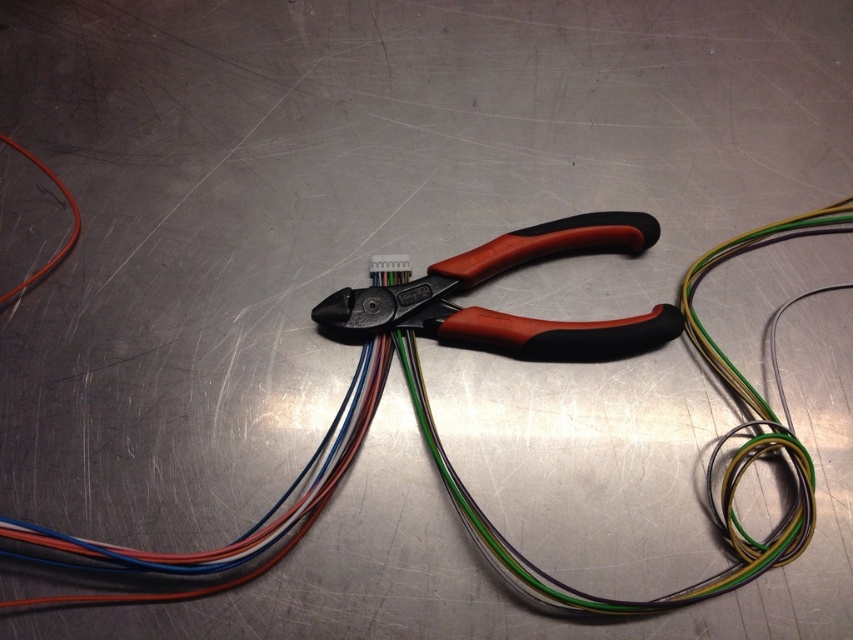
Question: Which point is closer to the camera?

Choices:
 (A) matte black pliers at center
 (B) orange rubberized pliers at center

Answer: (B)

Question: Which object is farther from the camera taking this photo?

Choices:
 (A) matte black pliers at center
 (B) orange cable at left
 (C) orange rubberized pliers at center

Answer: (A)

Question: Does orange rubberized pliers at center appear under matte black pliers at center?

Choices:
 (A) yes
 (B) no

Answer: (A)

Question: Which point is closer to the camera?

Choices:
 (A) (44, 268)
 (B) (614, 211)
 (C) (387, 268)

Answer: (A)

Question: Does orange cable at left appear under matte black pliers at center?

Choices:
 (A) yes
 (B) no

Answer: (B)

Question: Does orange rubberized pliers at center appear under orange cable at left?

Choices:
 (A) no
 (B) yes

Answer: (B)